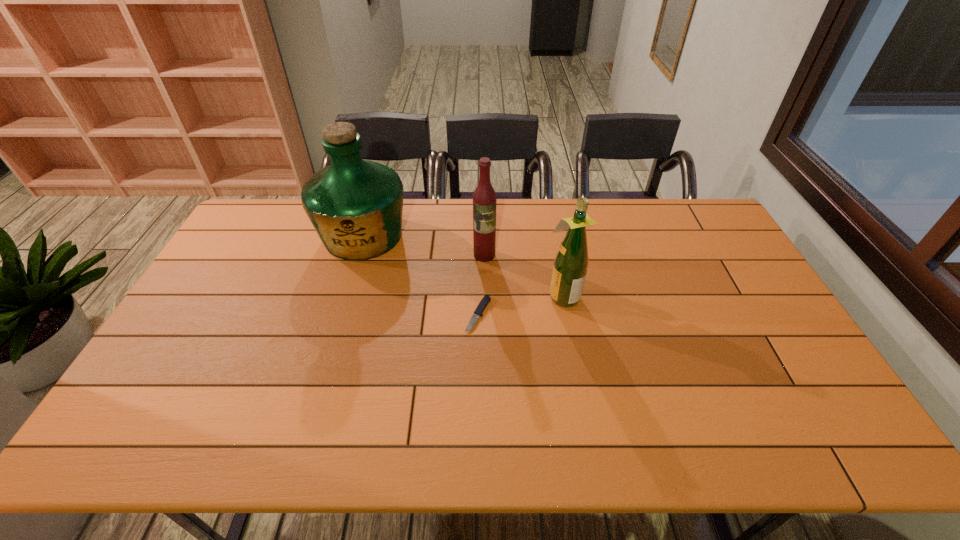
This screenshot has width=960, height=540. Find the location of `the leftmost object`. the leftmost object is located at coordinates (355, 205).

The height and width of the screenshot is (540, 960). What are the coordinates of `the second liquor from left to right` in the screenshot? It's located at (484, 198).

Where is `the rightmost object`? Image resolution: width=960 pixels, height=540 pixels. the rightmost object is located at coordinates (571, 261).

Where is `the rightmost liquor`? the rightmost liquor is located at coordinates (571, 261).

Where is `the shortest object`? the shortest object is located at coordinates (485, 300).

Locate an element on the screen. The height and width of the screenshot is (540, 960). free space located on the label side of the leftmost liquor is located at coordinates (347, 292).

Find the location of a particular element. vacant position located 0.240m on the label of the second liquor from left to right is located at coordinates [x=485, y=318].

This screenshot has height=540, width=960. Find the location of `free spot located on the front-facing side of the nearest liquor`. free spot located on the front-facing side of the nearest liquor is located at coordinates (487, 295).

Locate an element on the screen. The width and height of the screenshot is (960, 540). free space located 0.150m on the front-facing side of the nearest liquor is located at coordinates (496, 295).

At what (x,y) coordinates should I click in order to perform the action: click on free space located on the front-facing side of the nearest liquor. Please return your answer as a coordinate pair (x, y). This screenshot has height=540, width=960. Looking at the image, I should click on (470, 295).